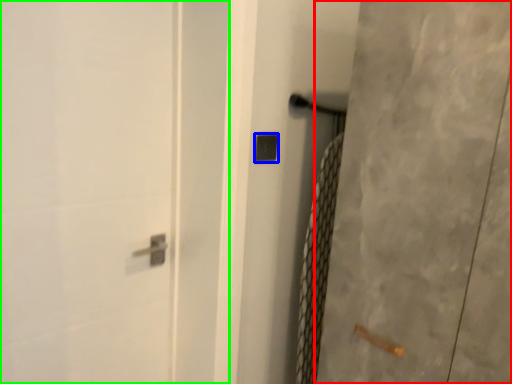
Question: Estimate the real-world distances between objects in this image. Which object is closer to screen door (highlighted by a red box), lock (highlighted by a blue box) or screen door (highlighted by a green box)?

Choices:
 (A) lock
 (B) screen door

Answer: (A)